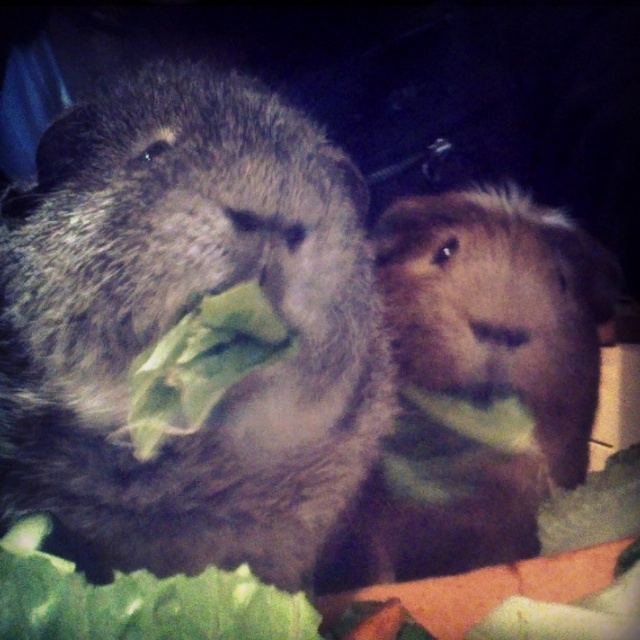
Question: Is the position of fuzzy brown guinea pig at center more distant than that of green leafy vegetable at center?

Choices:
 (A) no
 (B) yes

Answer: (B)

Question: Which of these objects is positioned closest to the fuzzy gray guinea pig at left?

Choices:
 (A) fuzzy brown guinea pig at center
 (B) green leafy vegetable at center

Answer: (B)

Question: Which point appears closest to the camera in this image?

Choices:
 (A) (177, 556)
 (B) (372, 560)
 (C) (209, 336)

Answer: (C)

Question: Where is fuzzy brown guinea pig at center located in relation to green leafy vegetable at center in the image?

Choices:
 (A) left
 (B) right

Answer: (B)

Question: Which point appears closest to the camera in this image?

Choices:
 (A) (285, 332)
 (B) (566, 394)

Answer: (A)

Question: Is fuzzy gray guinea pig at left to the left of green leafy vegetable at center from the viewer's perspective?

Choices:
 (A) no
 (B) yes

Answer: (A)